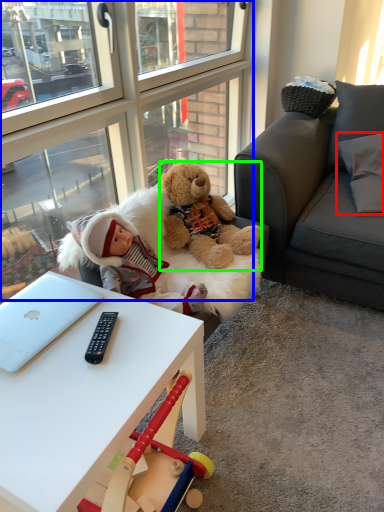
Question: Which is nearer to the pillow (highlighted by a red box)? glass door (highlighted by a blue box) or teddy bear (highlighted by a green box).

Choices:
 (A) glass door
 (B) teddy bear

Answer: (B)